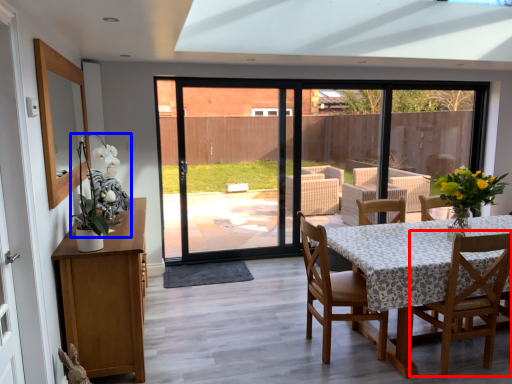
Question: Which object is further to the camera taking this photo, chair (highlighted by a red box) or floral arrangement (highlighted by a blue box)?

Choices:
 (A) chair
 (B) floral arrangement

Answer: (A)